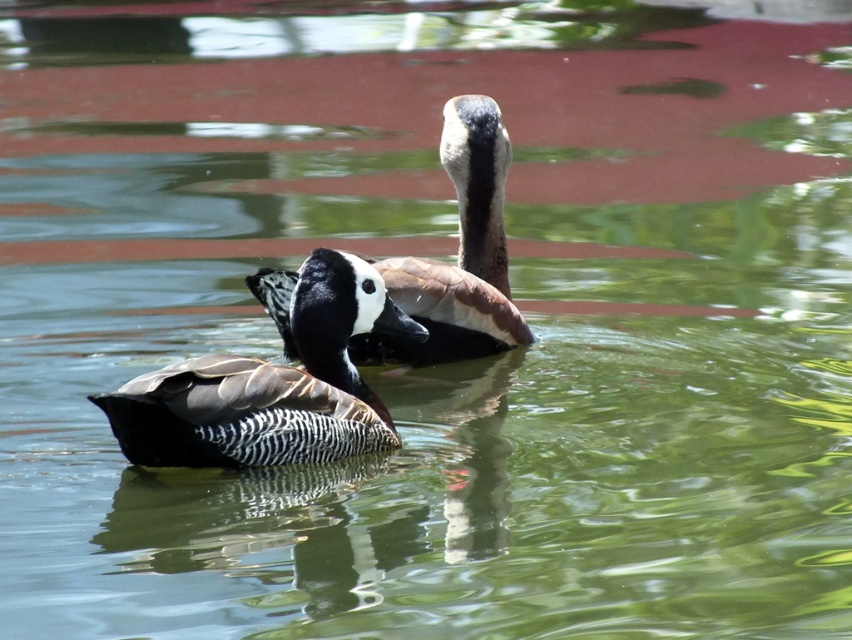
Question: Is speckled brown duck at center to the left of white glossy duck at center from the viewer's perspective?

Choices:
 (A) no
 (B) yes

Answer: (B)

Question: Is speckled brown duck at center below white glossy duck at center?

Choices:
 (A) yes
 (B) no

Answer: (A)

Question: Which object is farther from the camera taking this photo?

Choices:
 (A) white glossy duck at center
 (B) speckled brown duck at center

Answer: (A)

Question: Can you confirm if speckled brown duck at center is wider than white glossy duck at center?

Choices:
 (A) yes
 (B) no

Answer: (A)